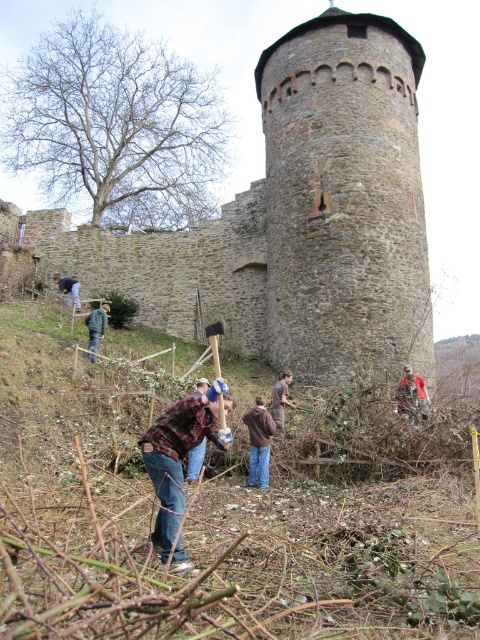
Question: Does plaid flannel shirt at center have a smaller size compared to denim jacket at lower left?

Choices:
 (A) yes
 (B) no

Answer: (B)

Question: Does flannel shirt at center have a larger size compared to brown cotton shirt at center?

Choices:
 (A) no
 (B) yes

Answer: (B)

Question: Which object is closer to the camera taking this photo?

Choices:
 (A) brown cotton jacket at center
 (B) camouflage jacket at upper right
 (C) dark gray stone tower at center

Answer: (A)

Question: Based on their relative distances, which object is farther from the plaid flannel shirt at center?

Choices:
 (A) denim jacket at lower left
 (B) gray stone tower at center
 (C) brown cotton jacket at center

Answer: (A)

Question: Does brown cotton jacket at center have a smaller size compared to green denim jacket at lower left?

Choices:
 (A) yes
 (B) no

Answer: (A)

Question: Based on their relative distances, which object is farther from the brown cotton jacket at center?

Choices:
 (A) dark gray stone tower at center
 (B) gray stone tower at center

Answer: (A)